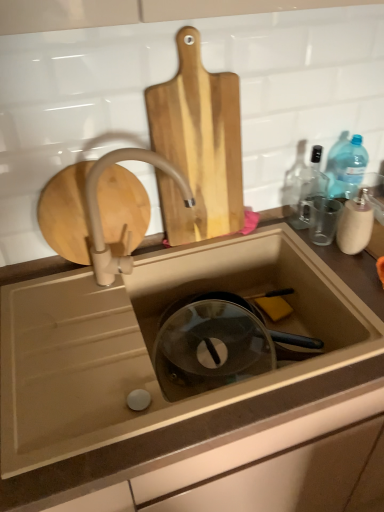
Question: From a real-world perspective, is natural wood cutting board at upper center physically located above or below yellow sponge at sink bottom?

Choices:
 (A) below
 (B) above

Answer: (B)

Question: Does point (170, 129) appear closer or farther from the camera than point (259, 296)?

Choices:
 (A) farther
 (B) closer

Answer: (B)

Question: Based on their relative distances, which object is farther from the yellow sponge at sink bottom?

Choices:
 (A) translucent plastic sink at center
 (B) white matte faucet at upper center
 (C) natural wood cutting board at upper center
 (D) transparent glass bottle at upper right

Answer: (B)

Question: Estimate the real-world distances between objects in this image. Which object is farther from the natural wood cutting board at upper center?

Choices:
 (A) white matte faucet at upper center
 (B) yellow sponge at sink bottom
 (C) translucent plastic sink at center
 (D) transparent glass bottle at upper right

Answer: (B)